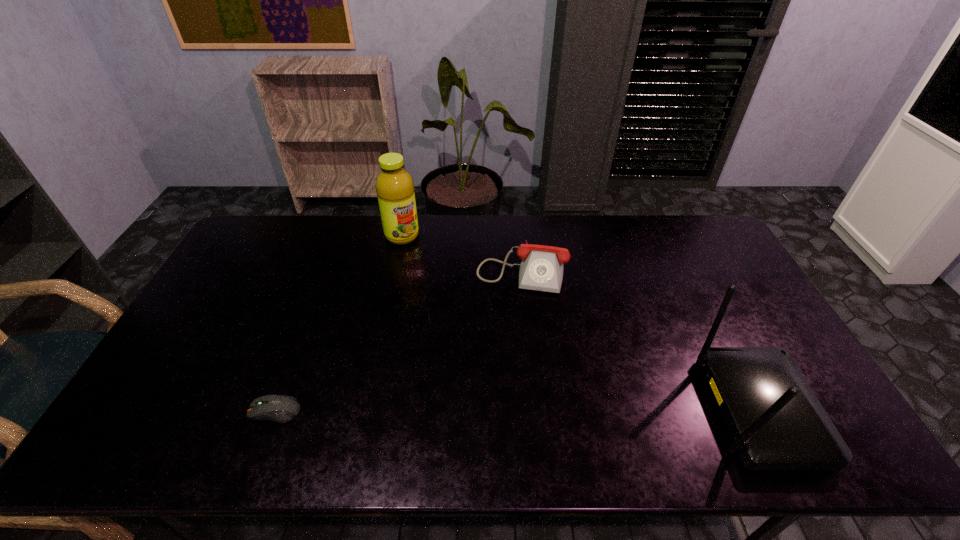
Identify the location of vacant space on the desktop that is between the computer equipment and the rightmost object and is positioned on the dial of the telephone. (498, 411).

Find the location of `vacant space on the desktop that is between the computer equipment and the rightmost object and is positioned on the front label of the fruit juice`. vacant space on the desktop that is between the computer equipment and the rightmost object and is positioned on the front label of the fruit juice is located at coordinates (548, 411).